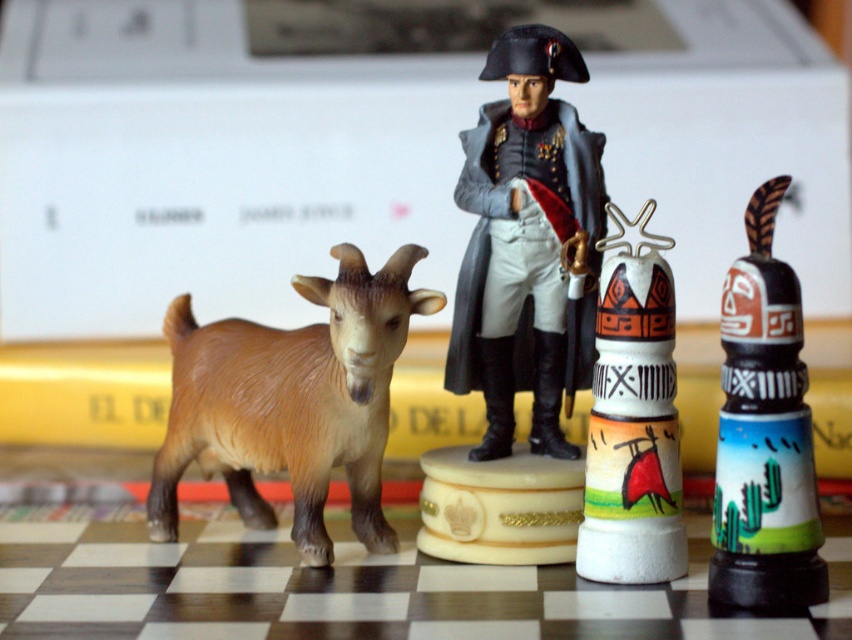
Question: Is brown matte goat at left behind white ceramic totem pole at center right?

Choices:
 (A) yes
 (B) no

Answer: (A)

Question: Considering the real-world distances, which object is closest to the painted ceramic totem pole at right?

Choices:
 (A) white ceramic totem pole at center right
 (B) matte gray figurine at center

Answer: (A)

Question: Which object is farther from the camera taking this photo?

Choices:
 (A) white ceramic totem pole at center right
 (B) matte gray figurine at center
 (C) brown matte goat at left
 (D) painted ceramic totem pole at right

Answer: (B)

Question: Can you confirm if matte gray figurine at center is thinner than painted ceramic totem pole at right?

Choices:
 (A) yes
 (B) no

Answer: (B)

Question: Which point is farther from the camera taking this photo?

Choices:
 (A) (453, 337)
 (B) (735, 340)

Answer: (A)

Question: Is painted ceramic totem pole at right bigger than white ceramic totem pole at center right?

Choices:
 (A) no
 (B) yes

Answer: (A)